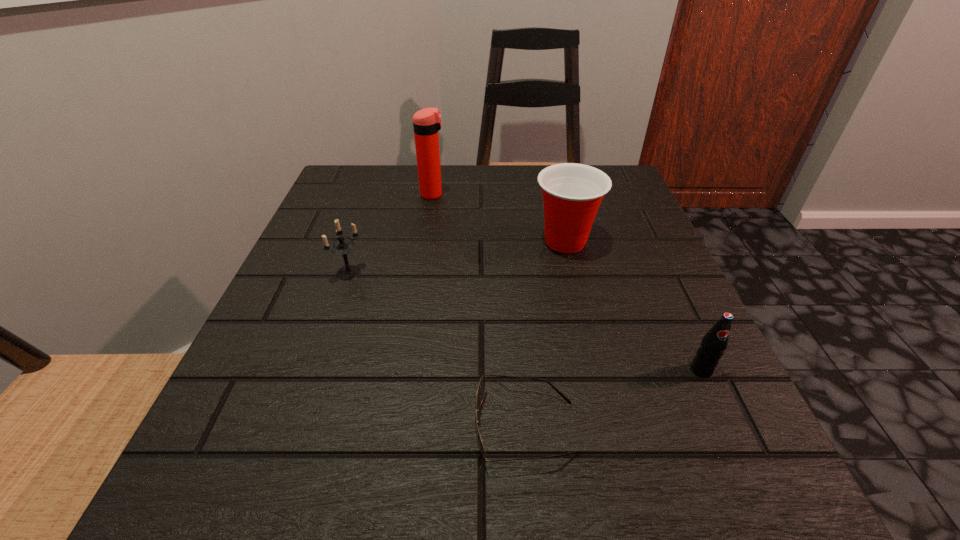
The height and width of the screenshot is (540, 960). Identify the location of vacant space that is in between the pop and the third nearest object. coord(525,321).

At what (x,y) coordinates should I click in order to perform the action: click on free spot between the third farthest object and the sunglasses. Please return your answer as a coordinate pair (x, y). Looking at the image, I should click on (437, 350).

Locate an element on the screen. The image size is (960, 540). vacant area that lies between the thermos bottle and the nearest object is located at coordinates pos(479,311).

The width and height of the screenshot is (960, 540). What are the coordinates of `free point between the leftmost object and the cup` in the screenshot? It's located at (457, 257).

Identify the location of free space between the second object from left to right and the cup. Image resolution: width=960 pixels, height=540 pixels. (499, 218).

At what (x,y) coordinates should I click in order to perform the action: click on vacant area between the candle holder and the shortest object. Please return your answer as a coordinate pair (x, y). Looking at the image, I should click on (437, 350).

Where is `vacant area between the farthest object and the fourth nearest object`? The height and width of the screenshot is (540, 960). vacant area between the farthest object and the fourth nearest object is located at coordinates (499, 218).

Where is `unoccupied area between the second tallest object and the second object from left to right`? Image resolution: width=960 pixels, height=540 pixels. unoccupied area between the second tallest object and the second object from left to right is located at coordinates (499, 218).

What are the coordinates of `free spot between the shortest object and the rightmost object` in the screenshot? It's located at (613, 399).

In order to click on free area in between the third farthest object and the tallest object in this screenshot , I will do `click(391, 234)`.